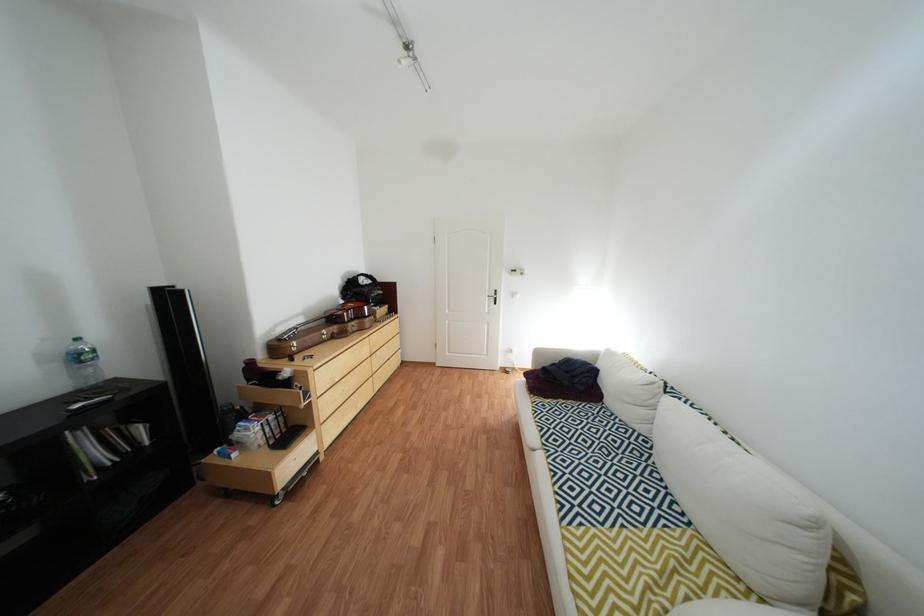
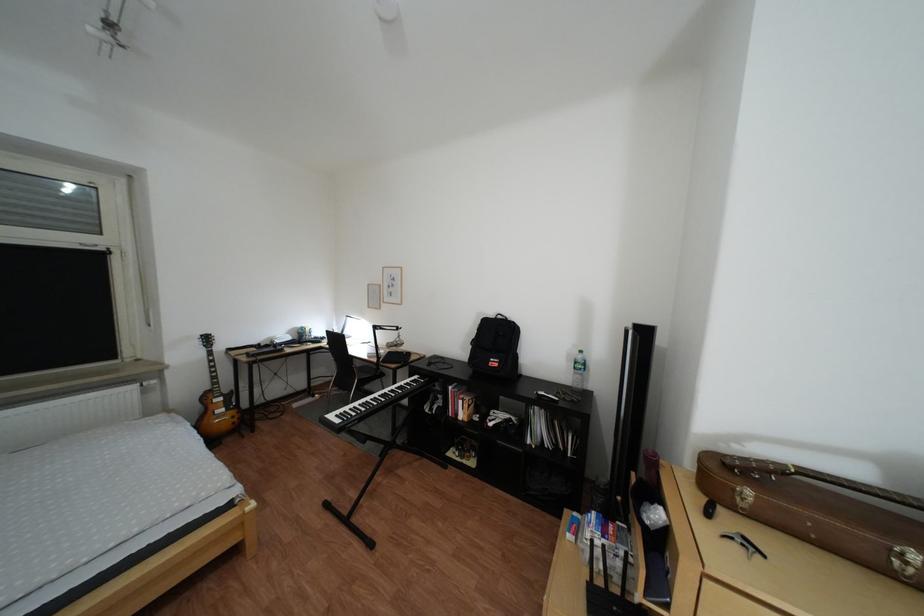
In the second image, find the point that corresponds to (x=334, y=334) in the first image.

(885, 537)